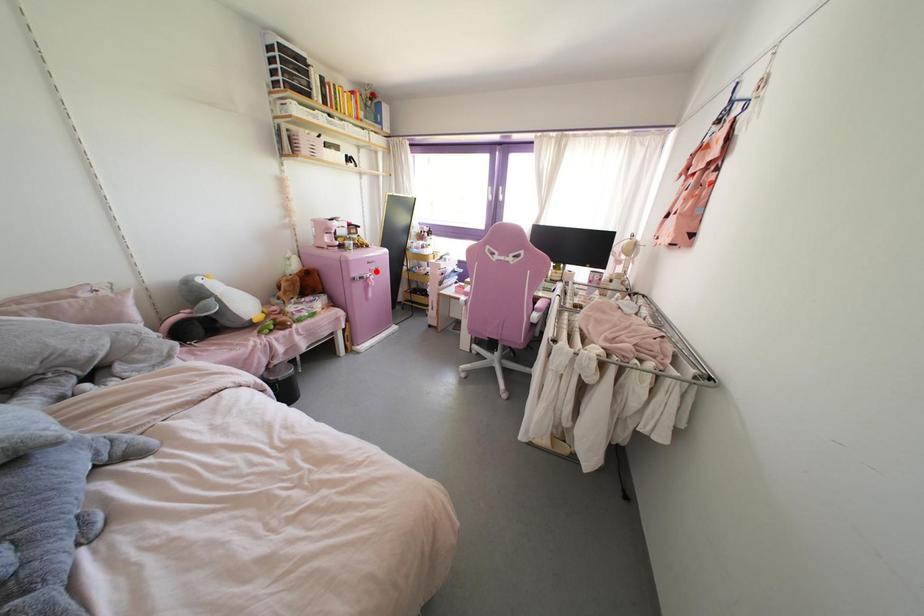
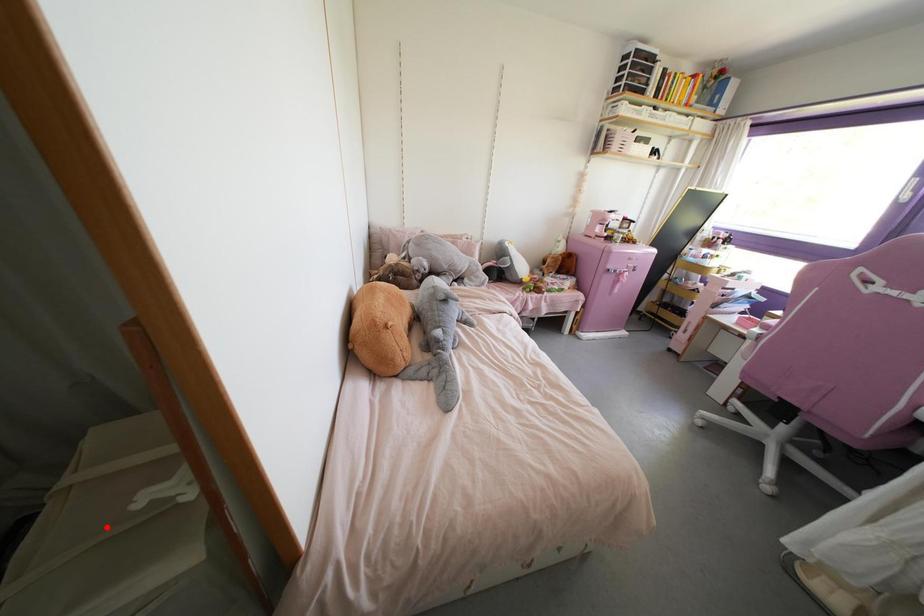
I am providing you with two images of the same scene from different viewpoints. A red point is marked on the first image and another point is marked on the second image. Is the marked point in image1 the same physical position as the marked point in image2?

No